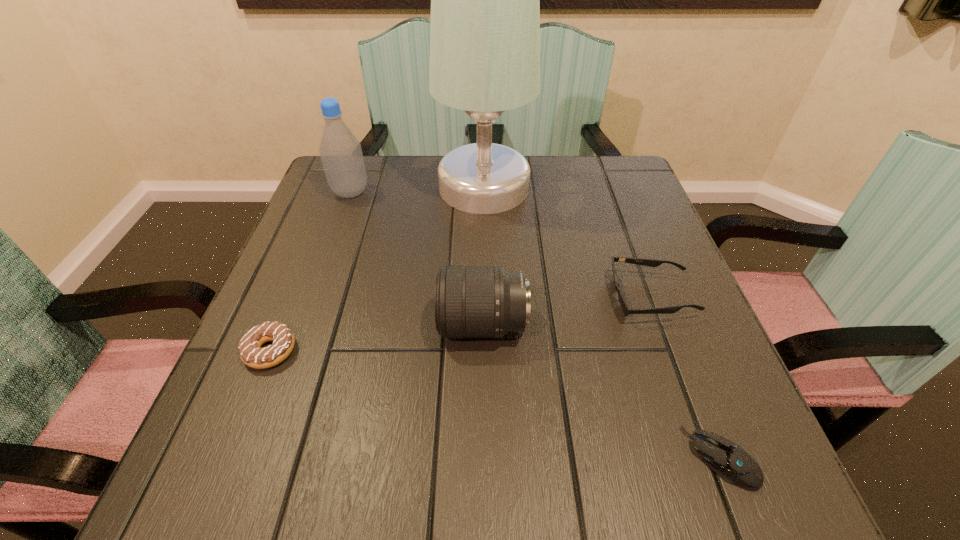
You are a GUI agent. You are given a task and a screenshot of the screen. Output one action in this format:
    pyautogui.click(x=<x>, y=<y>)
    Task: Click on the tallest object
    
    Given the screenshot: What is the action you would take?
    pyautogui.click(x=485, y=0)

Locate an element on the screen. the second tallest object is located at coordinates (340, 151).

I want to click on the third tallest object, so click(x=470, y=301).

Image resolution: width=960 pixels, height=540 pixels. In order to click on the fourth tallest object in this screenshot , I will do `click(626, 309)`.

Where is `the second shortest object`? the second shortest object is located at coordinates (251, 353).

Locate an element on the screen. the nearest object is located at coordinates (727, 459).

The height and width of the screenshot is (540, 960). In order to click on computer mouse in this screenshot , I will do `click(727, 459)`.

Locate an element on the screen. free space located on the base of the tallest object is located at coordinates (328, 187).

The width and height of the screenshot is (960, 540). In order to click on free space located on the base of the tallest object in this screenshot , I will do `click(369, 187)`.

This screenshot has height=540, width=960. In order to click on free space located on the base of the tallest object in this screenshot , I will do `click(320, 187)`.